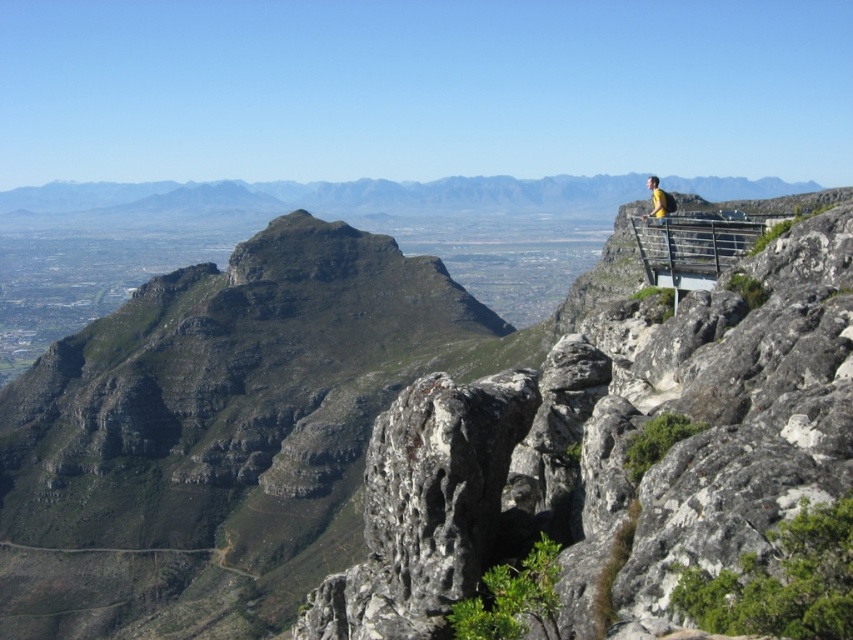
You are a hiker planning to take a photo of the rugged rock formation at upper center. If you want to include it in your shot without any obstructions, which direction should you face to ensure it is centered in your camera viewfinder?

The rugged rock formation at upper center is located at coordinates point (410, 435), so you should face the direction where the camera viewfinder aligns with those coordinates to center it without obstructions.

You are standing at the vantage point overlooking the mountain landscape. You see the metallic gray rail at upper right and the yellow fabric at upper right. Which object is nearer to you?

The metallic gray rail at upper right is closer to the viewer than the yellow fabric at upper right.

You are a hiker planning to take a photo of the rugged rock formation at upper center. There is a metallic gray rail at upper right nearby. To avoid the rail blocking your view, which direction should you move relative to the rail?

The rugged rock formation at upper center is positioned under the metallic gray rail at upper right. To avoid the rail blocking your view, you should move to the left or downward relative to the rail.